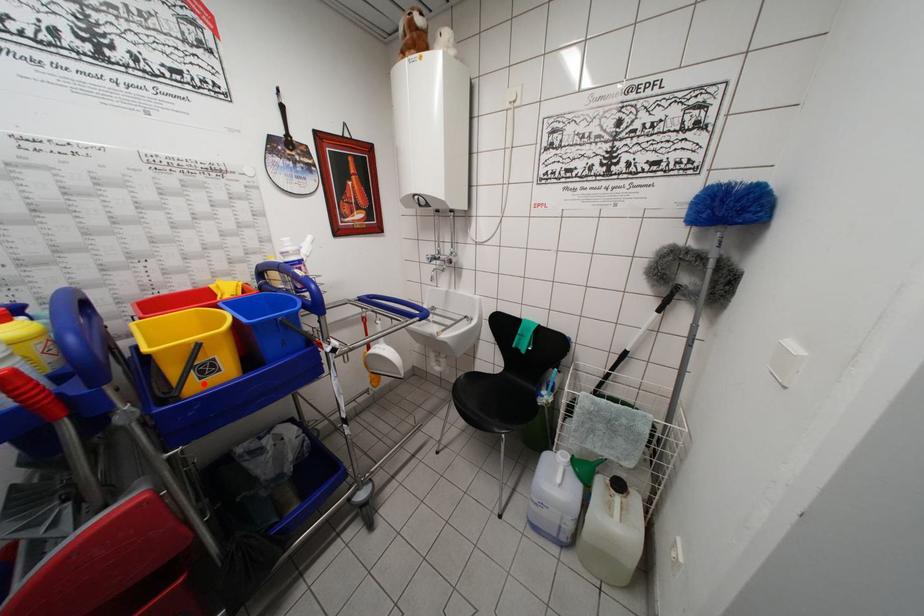
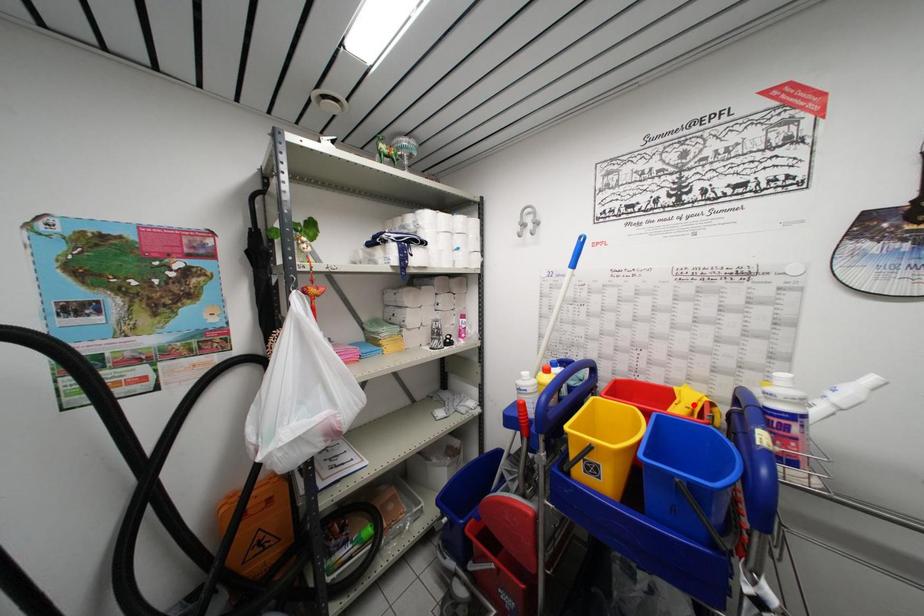
I am providing you with two images of the same scene from different viewpoints. A red point is marked on the first image and another point is marked on the second image. Does the point marked in image1 correspond to the same location as the one in image2?

No